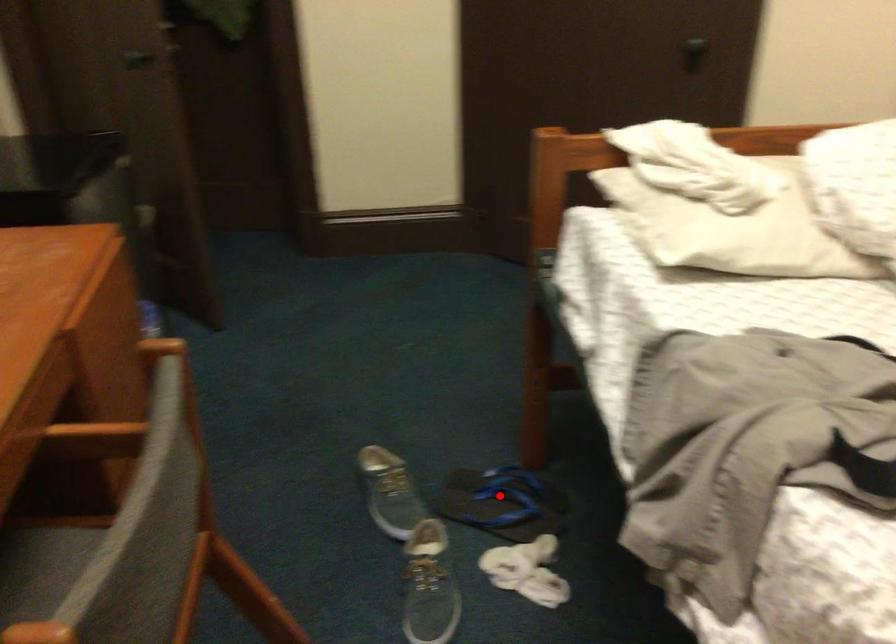
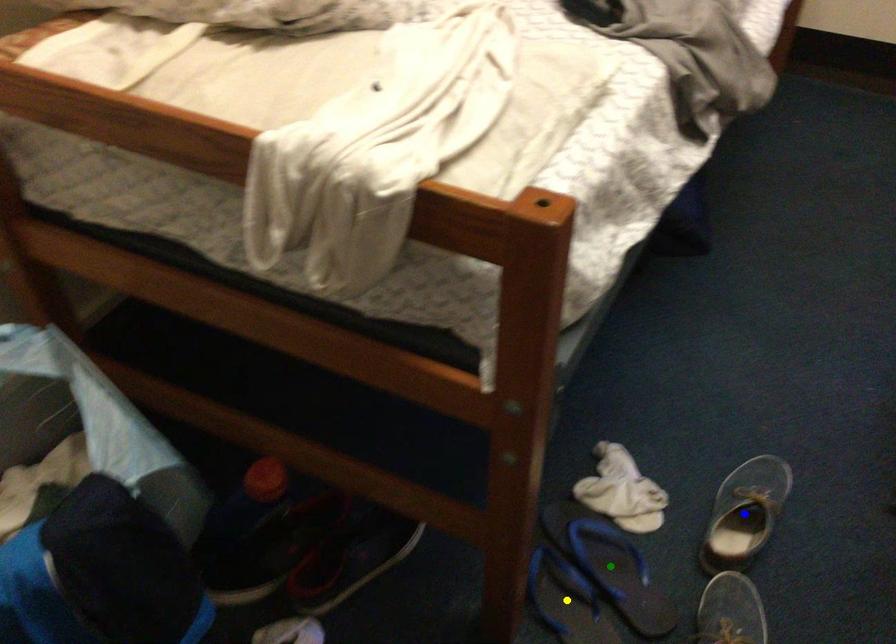
Question: I am providing you with two images of the same scene from different viewpoints. A red point is marked on the first image. You are given multiple points on the second image. Which point in image 2 represents the same 3d spot as the red point in image 1?

Choices:
 (A) yellow point
 (B) green point
 (C) blue point

Answer: (A)